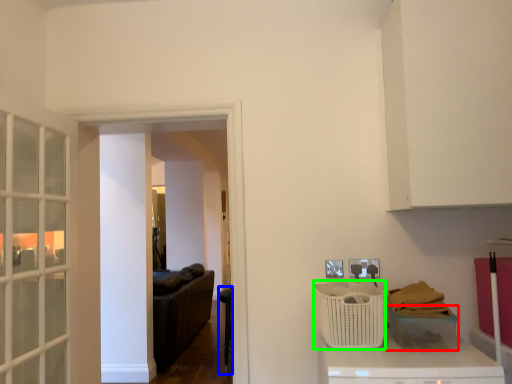
Question: Considering the real-world distances, which object is closest to basket (highlighted by a red box)? furniture (highlighted by a blue box) or basket (highlighted by a green box).

Choices:
 (A) furniture
 (B) basket

Answer: (B)